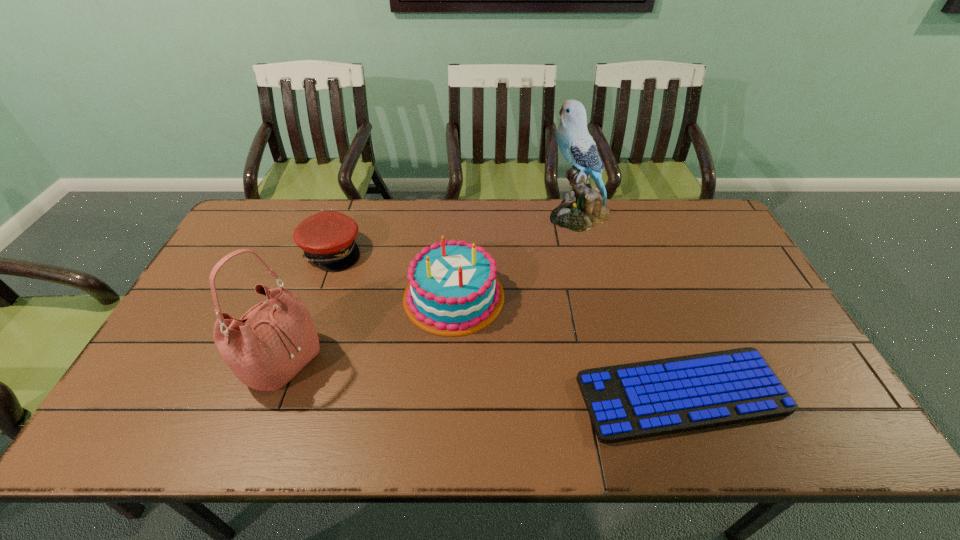
The width and height of the screenshot is (960, 540). In the image, there is a desktop. In order to click on vacant space at the left edge in this screenshot , I will do `click(172, 353)`.

At what (x,y) coordinates should I click in order to perform the action: click on free space at the right edge of the desktop. Please return your answer as a coordinate pair (x, y). The image size is (960, 540). Looking at the image, I should click on (751, 270).

What are the coordinates of `vacant space at the far left corner` in the screenshot? It's located at (237, 238).

Find the location of a particular element. This screenshot has height=540, width=960. vacant space at the near left corner is located at coordinates (185, 419).

Image resolution: width=960 pixels, height=540 pixels. I want to click on free space between the computer keyboard and the second tallest object, so click(482, 378).

Locate an element on the screen. free area in between the shortest object and the third tallest object is located at coordinates (568, 345).

Locate an element on the screen. This screenshot has width=960, height=540. vacant point located between the third object from left to right and the fourth tallest object is located at coordinates (393, 274).

Locate an element on the screen. The width and height of the screenshot is (960, 540). vacant area that lies between the cap and the fourth shortest object is located at coordinates (307, 307).

Where is `empty space that is in between the third object from right to left and the parakeet`? Image resolution: width=960 pixels, height=540 pixels. empty space that is in between the third object from right to left and the parakeet is located at coordinates (516, 256).

Find the location of a particular element. The width and height of the screenshot is (960, 540). free space between the parakeet and the birthday cake is located at coordinates (516, 256).